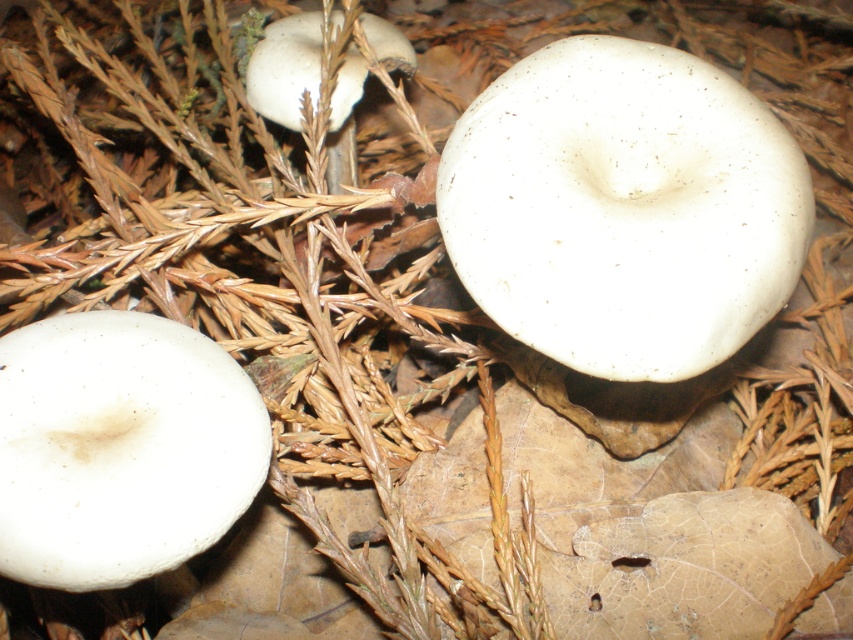
You are a hiker navigating through a forest and see two points marked on your map. The first point is labeled as point (579, 109) and the second is point (230, 502). According to the scene, which point is closer to you?

Point (230, 502) is closer to you because point (579, 109) is behind it.

You are a mycologist examining the scene. You need to determine the position of the white matte mushroom at center relative to the dried pine needles and fallen leaves. Based on the coordinates provided, can you identify its exact location?

The white matte mushroom at center is located at point coordinates of (624, 208).